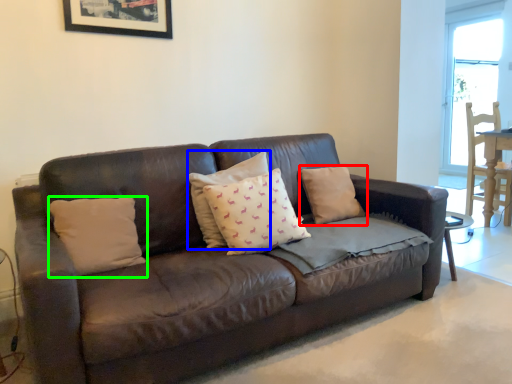
Question: Considering the real-world distances, which object is farthest from pillow (highlighted by a red box)? pillow (highlighted by a blue box) or pillow (highlighted by a green box)?

Choices:
 (A) pillow
 (B) pillow

Answer: (B)